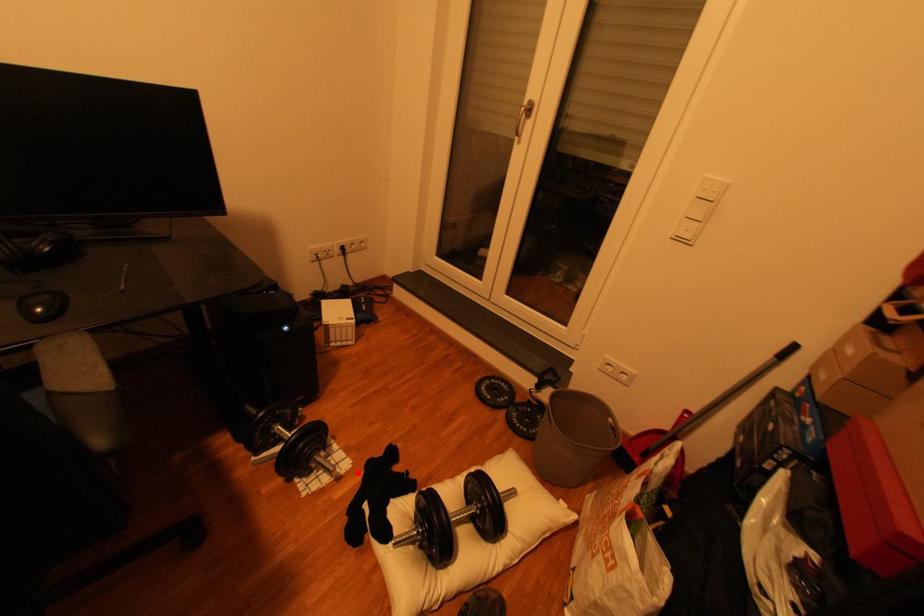
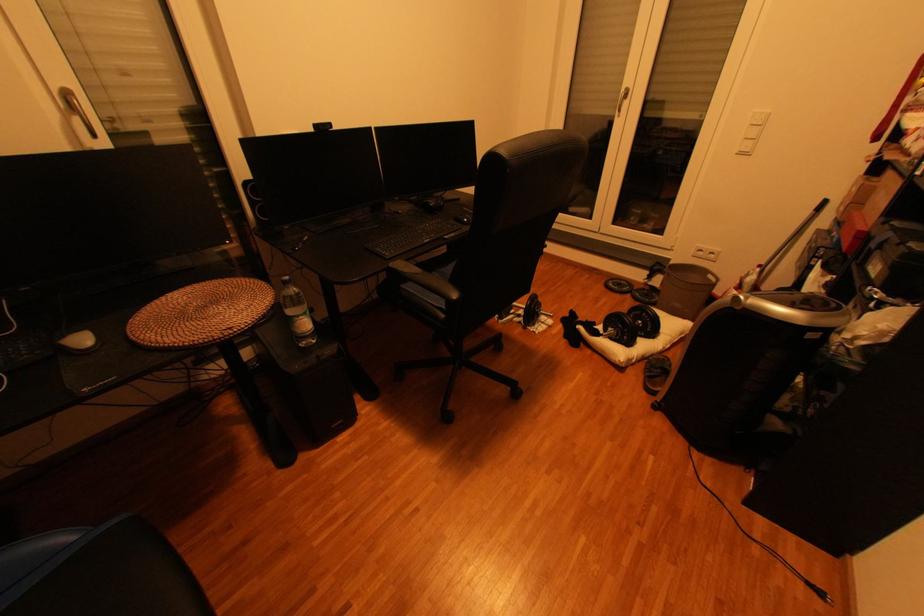
Locate, in the second image, the point that corresponds to the highlighted location in the first image.

(564, 323)